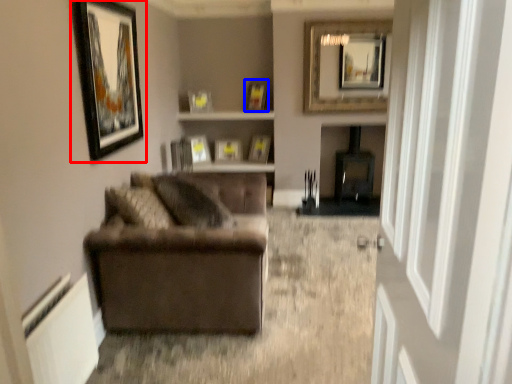
Question: Which object is further to the camera taking this photo, picture frame (highlighted by a red box) or picture frame (highlighted by a blue box)?

Choices:
 (A) picture frame
 (B) picture frame

Answer: (B)